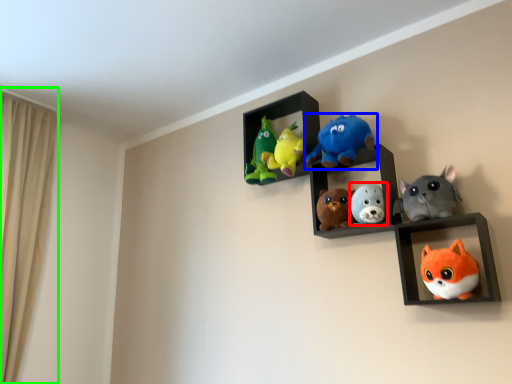
Question: Which is farther away from toy (highlighted by a red box)? toy (highlighted by a blue box) or curtain (highlighted by a green box)?

Choices:
 (A) toy
 (B) curtain

Answer: (B)